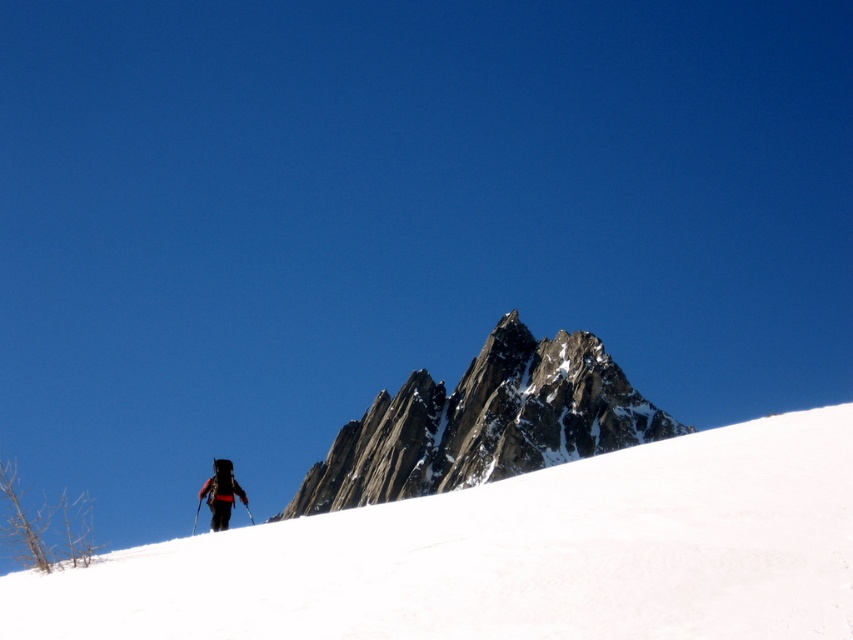
You are a hiker planning to climb the mountain. From your current position on the white snow at center, which direction should you head to reach the rocky gray mountain peak at center?

The white snow at center is in front of the rocky gray mountain peak at center, so you should head towards the direction where the peak is located, which is behind your current position on the white snow at center.